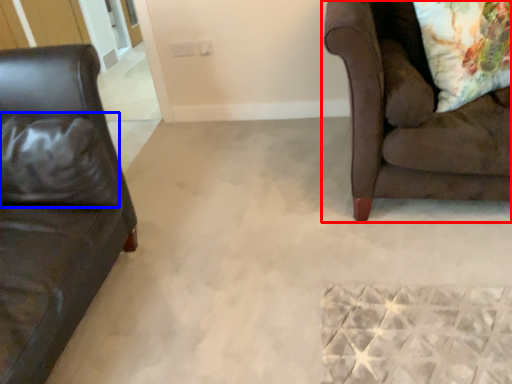
Question: Which point is further to the camera, studio couch (highlighted by a red box) or pillow (highlighted by a blue box)?

Choices:
 (A) studio couch
 (B) pillow

Answer: (B)